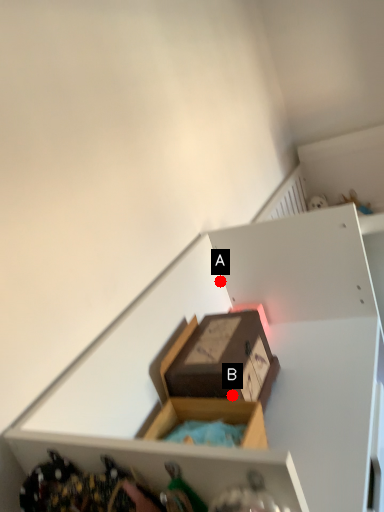
Question: Two points are circled on the image, labeled by A and B beside each circle. Which point is further to the camera?

Choices:
 (A) A is further
 (B) B is further

Answer: (A)